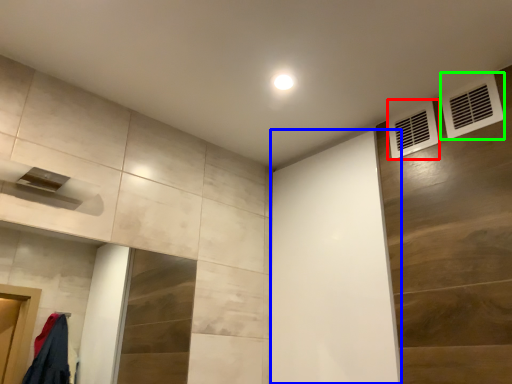
Question: Considering the real-world distances, which object is farthest from air conditioning (highlighted by a red box)? screen door (highlighted by a blue box) or air conditioning (highlighted by a green box)?

Choices:
 (A) screen door
 (B) air conditioning

Answer: (A)